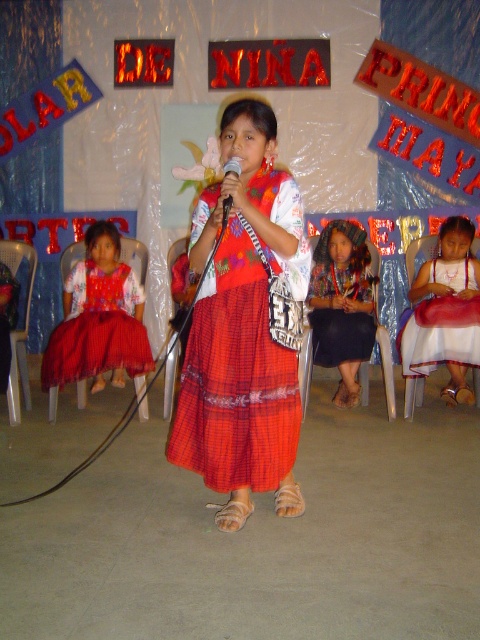
The width and height of the screenshot is (480, 640). Find the location of `red plaid skirt at center`. red plaid skirt at center is located at coordinates [x=236, y=380].

Between red plaid skirt at center and white satin dress at lower right, which one appears on the right side from the viewer's perspective?

white satin dress at lower right is more to the right.

I want to click on red plaid skirt at center, so click(x=236, y=380).

Find the location of a particular element. The height and width of the screenshot is (640, 480). red plaid skirt at center is located at coordinates (236, 380).

Can you confirm if white satin dress at lower right is thinner than black plastic microphone at center?

No.

Is white satin dress at lower right below black plastic microphone at center?

Yes.

Who is more distant from viewer, (415, 356) or (235, 163)?

The point (415, 356) is more distant.

I want to click on white satin dress at lower right, so click(444, 312).

You are a GUI agent. You are given a task and a screenshot of the screen. Output one action in this format:
    pyautogui.click(x=<x>, y=<y>)
    Task: Click on the red plaid skirt at center
    The height and width of the screenshot is (640, 480).
    Given the screenshot: What is the action you would take?
    pyautogui.click(x=236, y=380)

Is red plaid skirt at center positioned in front of red plaid skirt at lower left?

Yes, it is in front of red plaid skirt at lower left.

Between point (278, 205) and point (135, 332), which one is positioned in front?

Positioned in front is point (278, 205).

Locate an element on the screen. The height and width of the screenshot is (640, 480). red plaid skirt at center is located at coordinates (236, 380).